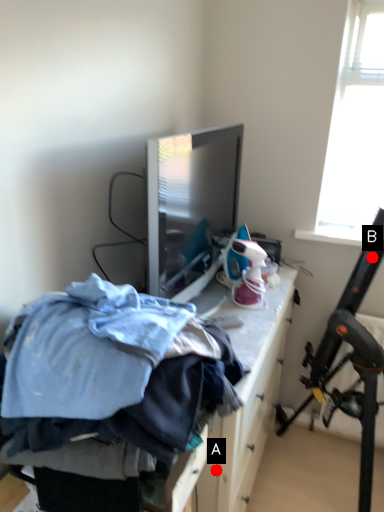
Question: Two points are circled on the image, labeled by A and B beside each circle. Among these points, which one is nearest to the camera?

Choices:
 (A) A is closer
 (B) B is closer

Answer: (A)